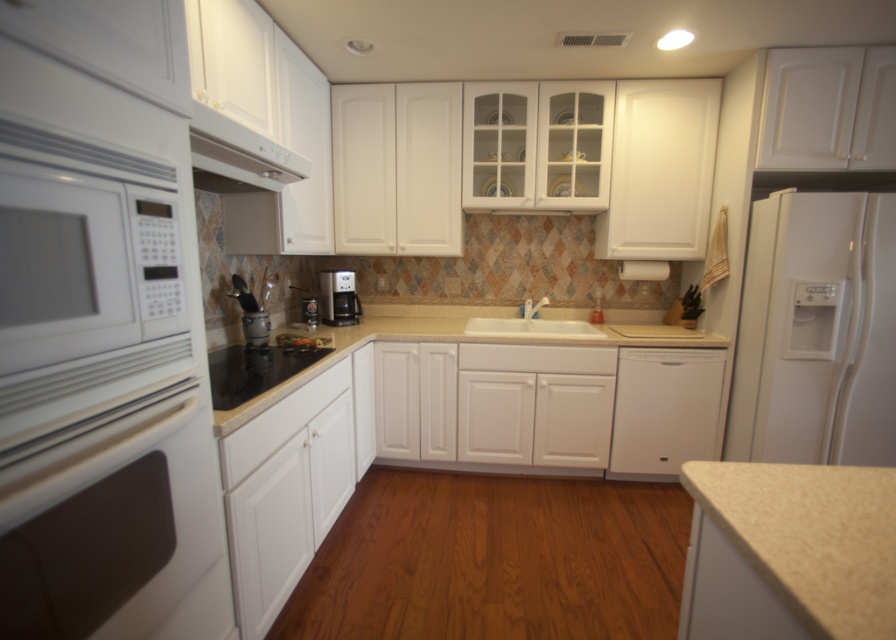
Question: Can you confirm if white matte dishwasher at center is positioned to the right of white glossy sink at center?

Choices:
 (A) no
 (B) yes

Answer: (B)

Question: Which is farther from the white matte microwave at left?

Choices:
 (A) black glass stove at center
 (B) beige granite countertop at center
 (C) white matte oven at left

Answer: (A)

Question: From the image, what is the correct spatial relationship of white matte microwave at left in relation to satin black coffee maker at center?

Choices:
 (A) above
 (B) below

Answer: (B)

Question: Which object is closer to the camera taking this photo?

Choices:
 (A) white glossy sink at center
 (B) black glass stove at center
 (C) white matte oven at left

Answer: (C)

Question: Is white matte refrigerator at right thinner than black glass stove at center?

Choices:
 (A) no
 (B) yes

Answer: (A)

Question: Which object is positioned farthest from the black glass stove at center?

Choices:
 (A) white matte refrigerator at right
 (B) white glossy exhaust hood at upper center
 (C) beige granite countertop at center
 (D) satin black coffee maker at center

Answer: (A)